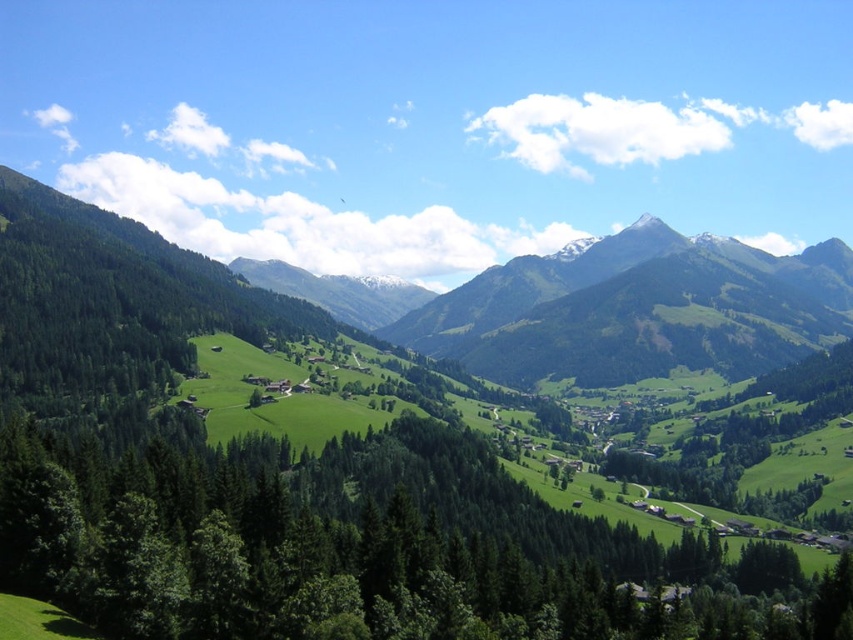
Question: Is green grassy mountain at left positioned before green grassy mountain at center?

Choices:
 (A) no
 (B) yes

Answer: (B)

Question: Which of the following is the farthest from the observer?

Choices:
 (A) (670, 598)
 (B) (193, 285)

Answer: (B)

Question: From the image, what is the correct spatial relationship of green grassy mountain at left in relation to green grassy mountain at center?

Choices:
 (A) right
 (B) left

Answer: (B)

Question: Which is nearer to the green grassy mountain at center?

Choices:
 (A) green grassy mountain at left
 (B) green textured trees at center

Answer: (A)

Question: Does green textured trees at center appear over green grassy mountain at center?

Choices:
 (A) no
 (B) yes

Answer: (A)

Question: Which point is farther from the camera taking this photo?

Choices:
 (A) (257, 609)
 (B) (268, 337)
 (C) (592, 365)

Answer: (C)